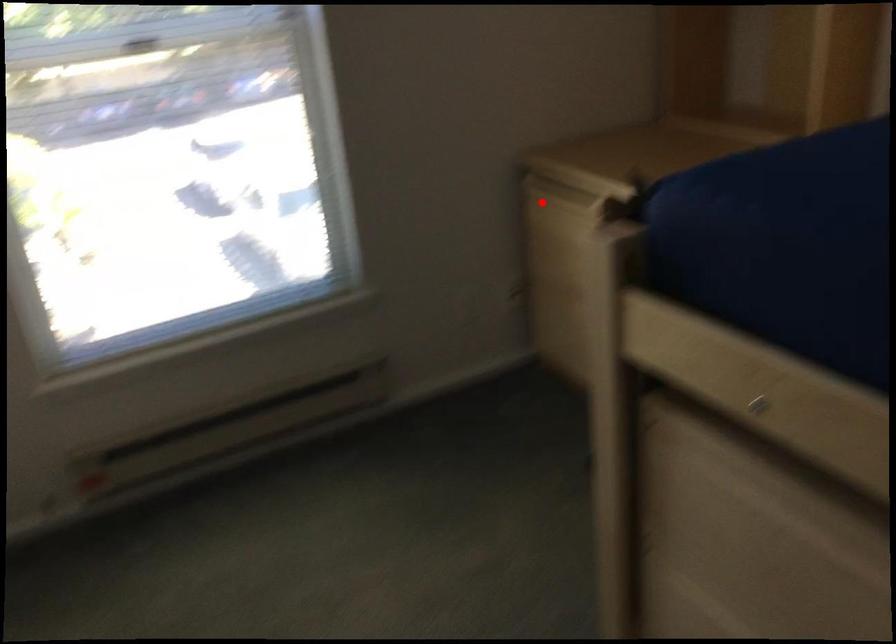
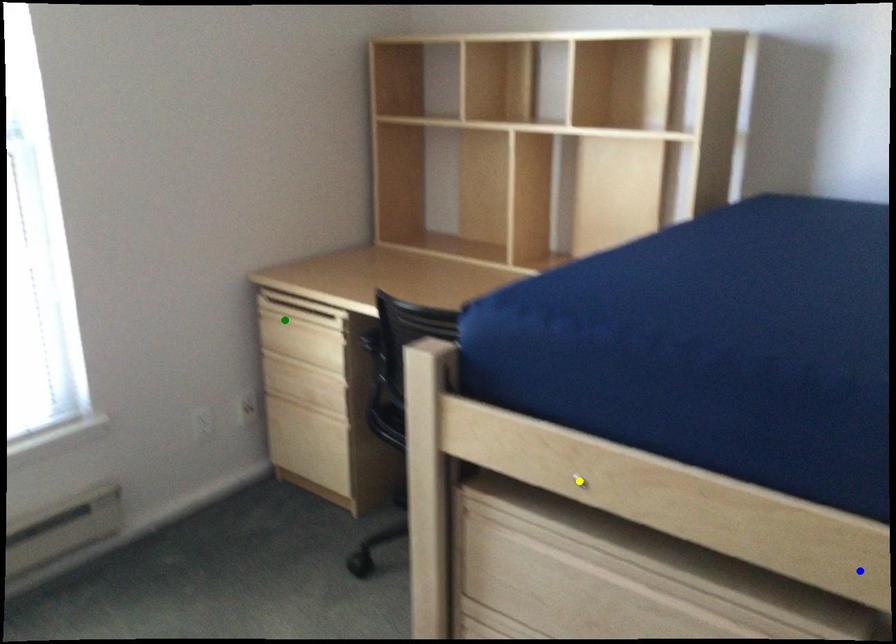
Question: I am providing you with two images of the same scene from different viewpoints. A red point is marked on the first image. You are given multiple points on the second image. Can you choose the point in image 2 that corresponds to the point in image 1?

Choices:
 (A) yellow point
 (B) blue point
 (C) green point

Answer: (C)